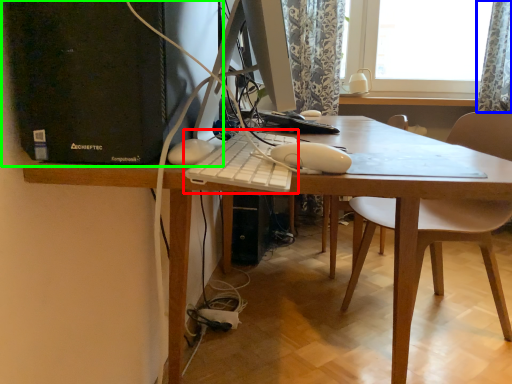
Question: Considering the real-world distances, which object is closest to computer keyboard (highlighted by a red box)? curtain (highlighted by a blue box) or computer tower (highlighted by a green box).

Choices:
 (A) curtain
 (B) computer tower

Answer: (B)